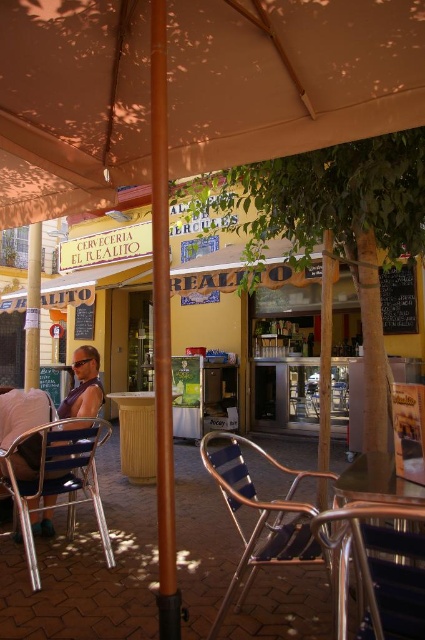
Who is taller, brown polished pole at center or brown wooden pole at center?

brown polished pole at center is taller.

Can you confirm if brown polished pole at center is shorter than brown wooden pole at center?

Incorrect, brown polished pole at center's height does not fall short of brown wooden pole at center's.

Does point (167, 380) come behind point (331, 312)?

No, it is not.

At what (x,y) coordinates should I click in order to perform the action: click on brown polished pole at center. Please return your answer as a coordinate pair (x, y). Looking at the image, I should click on (163, 332).

How much distance is there between metallic blue chair at lower center and metallic pole at left?

metallic blue chair at lower center and metallic pole at left are 6.04 meters apart.

Which is in front, point (422, 548) or point (30, 328)?

Point (422, 548)

You are a GUI agent. You are given a task and a screenshot of the screen. Output one action in this format:
    pyautogui.click(x=<x>, y=<y>)
    Task: Click on the metallic blue chair at lower center
    
    Given the screenshot: What is the action you would take?
    pyautogui.click(x=384, y=568)

This screenshot has width=425, height=640. Find the location of `brown polished pole at center`. brown polished pole at center is located at coordinates (163, 332).

Looking at this image, does brown polished pole at center have a larger size compared to metallic blue chair at lower center?

Correct, brown polished pole at center is larger in size than metallic blue chair at lower center.

The image size is (425, 640). Describe the element at coordinates (163, 332) in the screenshot. I see `brown polished pole at center` at that location.

You are a GUI agent. You are given a task and a screenshot of the screen. Output one action in this format:
    pyautogui.click(x=<x>, y=<y>)
    Task: Click on the brown polished pole at center
    The height and width of the screenshot is (640, 425).
    Given the screenshot: What is the action you would take?
    pyautogui.click(x=163, y=332)